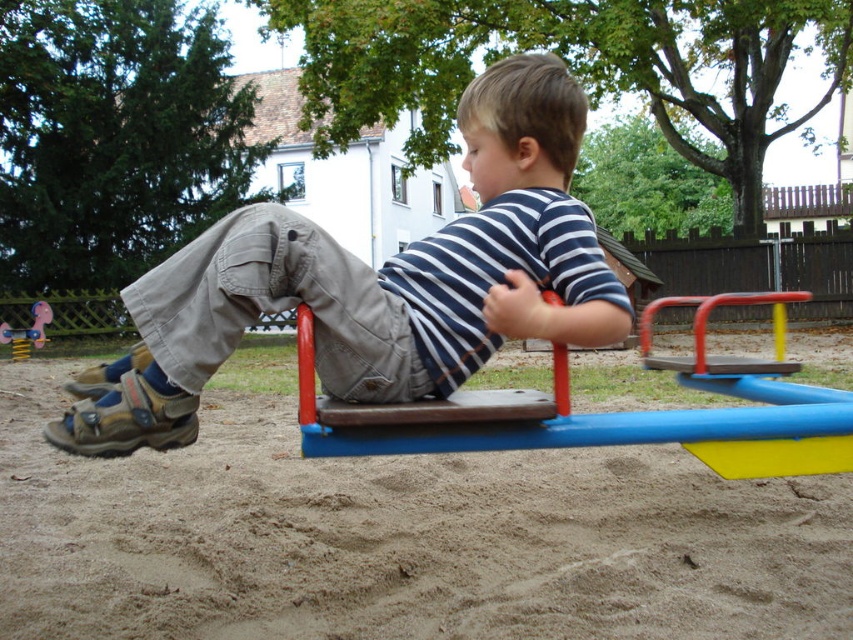
You are a drone operator trying to capture a photo of the child on the seesaw. You need to position the drone so that the camera is directly above the brown sandy ground at center. What are the 2D coordinates where you should place the drone?

The 2D coordinates for the brown sandy ground at center are at point (399, 538), so you should position the drone directly above those coordinates to capture the photo.

You are a parent looking for a place to sit while watching your child play on the seesaw. Which object from the scene would be more suitable for sitting, the brown leather bench at center or the matte plastic toy horse at lower left?

The brown leather bench at center is more suitable for sitting because it has a larger size compared to the matte plastic toy horse at lower left.

You are standing at the origin point in the playground. You want to sit on the brown leather bench at center. Which direction should you walk to reach it?

The brown leather bench at center is located at coordinates point (618, 412), so you should walk northeast to reach it.